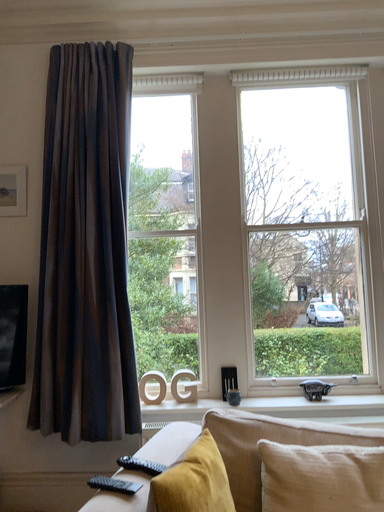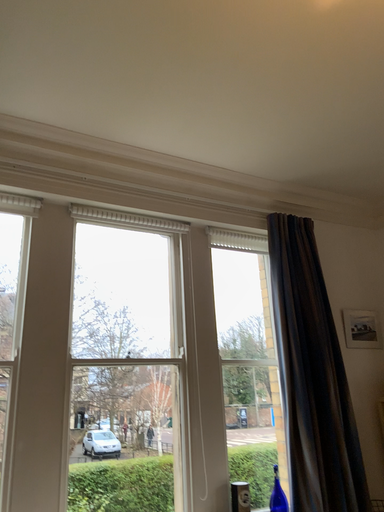
Question: Which way did the camera rotate in the video?

Choices:
 (A) rotated upward
 (B) rotated downward

Answer: (A)